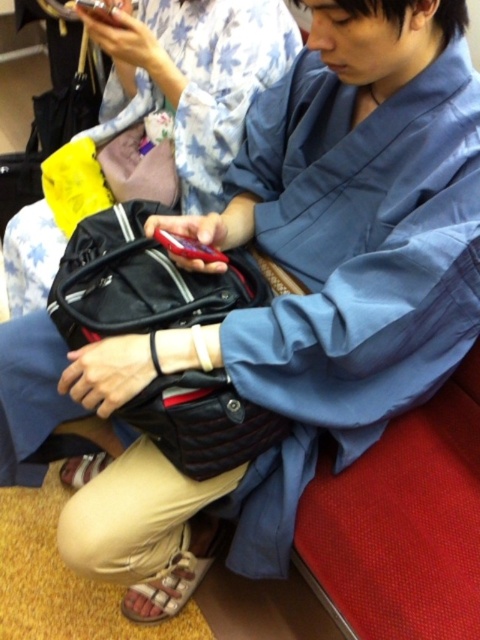
Image resolution: width=480 pixels, height=640 pixels. In order to click on matte black bag at center in this screenshot , I will do `click(155, 122)`.

Looking at this image, is matte black bag at center to the right of leather-like black bag at center from the viewer's perspective?

Incorrect, matte black bag at center is not on the right side of leather-like black bag at center.

Who is more forward, (211,180) or (66,291)?

Point (66,291) is in front.

You are a GUI agent. You are given a task and a screenshot of the screen. Output one action in this format:
    pyautogui.click(x=<x>, y=<y>)
    Task: Click on the matte black bag at center
    Image resolution: width=480 pixels, height=640 pixels.
    Given the screenshot: What is the action you would take?
    pyautogui.click(x=155, y=122)